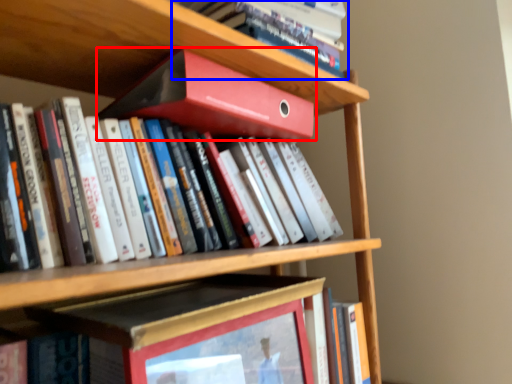
Question: Which object appears farthest to the camera in this image, book (highlighted by a red box) or book (highlighted by a blue box)?

Choices:
 (A) book
 (B) book

Answer: (B)